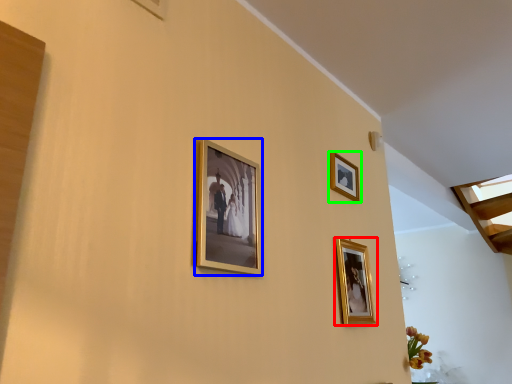
Question: Which is nearer to the picture frame (highlighted by a red box)? picture frame (highlighted by a blue box) or picture frame (highlighted by a green box).

Choices:
 (A) picture frame
 (B) picture frame

Answer: (B)